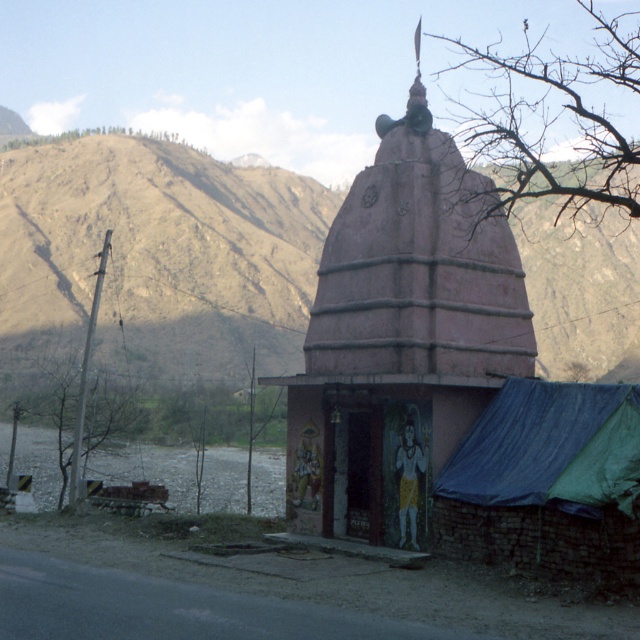
How far apart are blue tarpaulin tent at lower right and gray gravel lake at lower left?

A distance of 66.63 feet exists between blue tarpaulin tent at lower right and gray gravel lake at lower left.

Who is shorter, blue tarpaulin tent at lower right or gray gravel lake at lower left?

gray gravel lake at lower left

Does point (541, 403) come farther from viewer compared to point (269, 472)?

No, (541, 403) is in front of (269, 472).

At what (x,y) coordinates should I click in order to perform the action: click on blue tarpaulin tent at lower right. Please return your answer as a coordinate pair (x, y). The image size is (640, 640). Looking at the image, I should click on (541, 484).

Which of these two, pink matte temple at center or blue tarpaulin tent at lower right, stands taller?

pink matte temple at center is taller.

What do you see at coordinates (401, 337) in the screenshot? The width and height of the screenshot is (640, 640). I see `pink matte temple at center` at bounding box center [401, 337].

The width and height of the screenshot is (640, 640). In order to click on pink matte temple at center in this screenshot , I will do click(x=401, y=337).

Does point (179, 157) lie behind point (54, 497)?

Yes, it is behind point (54, 497).

Is point (205, 291) positioned after point (93, 452)?

Yes, it is behind point (93, 452).

The image size is (640, 640). I want to click on brown rocky mountain at upper center, so click(161, 252).